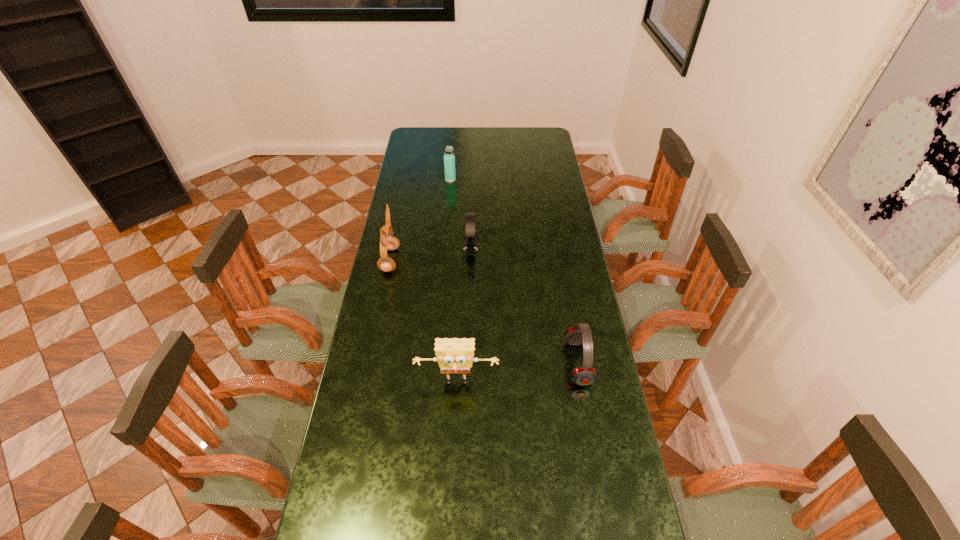
Identify the location of empty space between the second earphone from left to right and the rightmost object. This screenshot has height=540, width=960. (524, 305).

The height and width of the screenshot is (540, 960). Identify the location of free space between the nearest earphone and the leftmost object. (484, 311).

Find the location of a particular element. vacant region between the thermos bottle and the rightmost object is located at coordinates (515, 271).

Locate an element on the screen. Image resolution: width=960 pixels, height=540 pixels. empty space that is in between the sponge and the leftmost object is located at coordinates (423, 322).

Locate an element on the screen. vacant area between the leftmost object and the sponge is located at coordinates (423, 322).

This screenshot has height=540, width=960. In order to click on blank region between the tallest object and the second earphone from left to right in this screenshot , I will do `click(430, 254)`.

Locate which object ranks third in proximity to the second earphone from left to right. Please provide its 2D coordinates. Your answer should be formatted as a tuple, i.e. [(x, y)], where the tuple contains the x and y coordinates of a point satisfying the conditions above.

[(584, 375)]

Select which object is the second closest to the sponge. Please provide its 2D coordinates. Your answer should be formatted as a tuple, i.e. [(x, y)], where the tuple contains the x and y coordinates of a point satisfying the conditions above.

[(387, 241)]

Point out which earphone is positioned as the third nearest to the sponge. Please provide its 2D coordinates. Your answer should be formatted as a tuple, i.e. [(x, y)], where the tuple contains the x and y coordinates of a point satisfying the conditions above.

[(471, 234)]

Select which earphone is the closest to the farthest object. Please provide its 2D coordinates. Your answer should be formatted as a tuple, i.e. [(x, y)], where the tuple contains the x and y coordinates of a point satisfying the conditions above.

[(471, 234)]